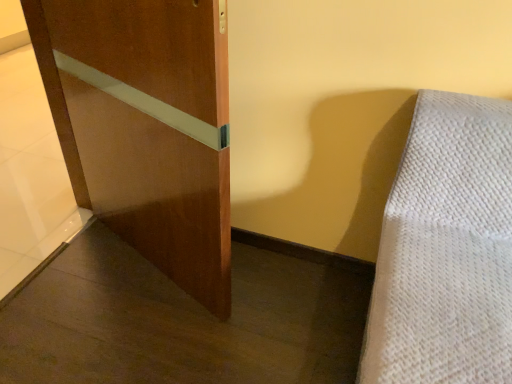
Find the location of a particular element. glossy wood door at center is located at coordinates (146, 126).

What is the approximate width of glossy wood door at center?

6.95 inches.

The width and height of the screenshot is (512, 384). What do you see at coordinates (146, 126) in the screenshot? I see `glossy wood door at center` at bounding box center [146, 126].

Identify the location of glossy wood door at center. pos(146,126).